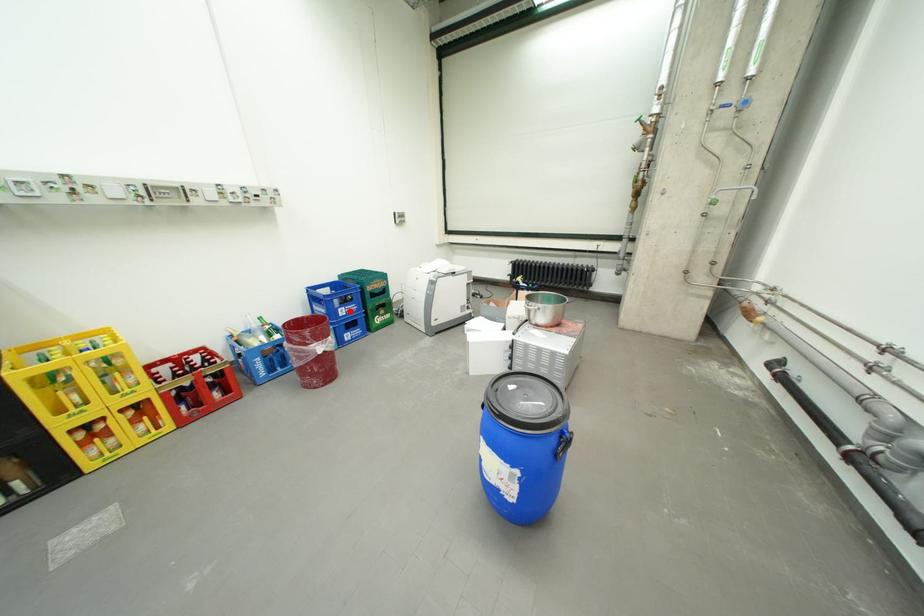
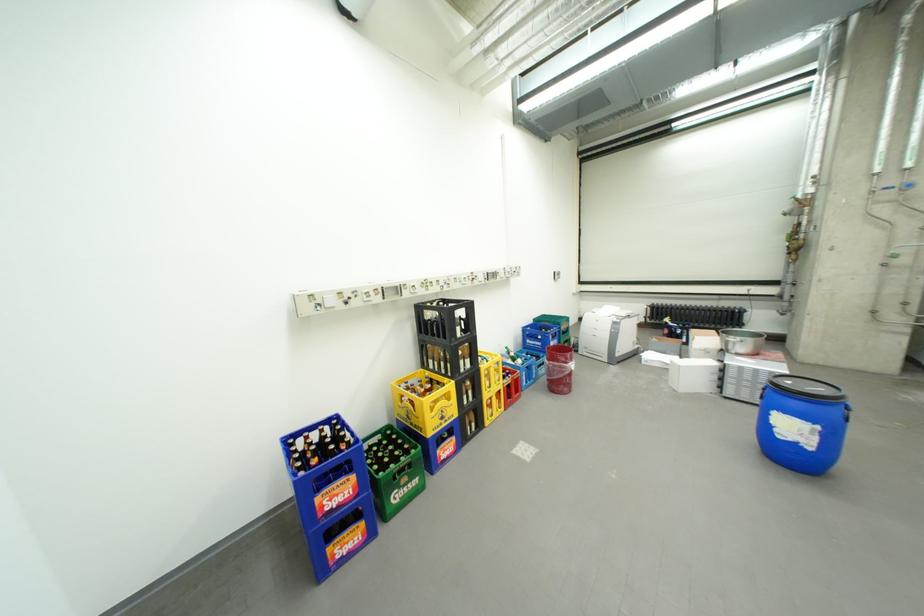
Question: I am providing you with two images of the same scene from different viewpoints. In image1, a red point is highlighted. Considering the same 3D point in image2, which of the following is correct?

Choices:
 (A) It is closer
 (B) It is farther

Answer: (B)